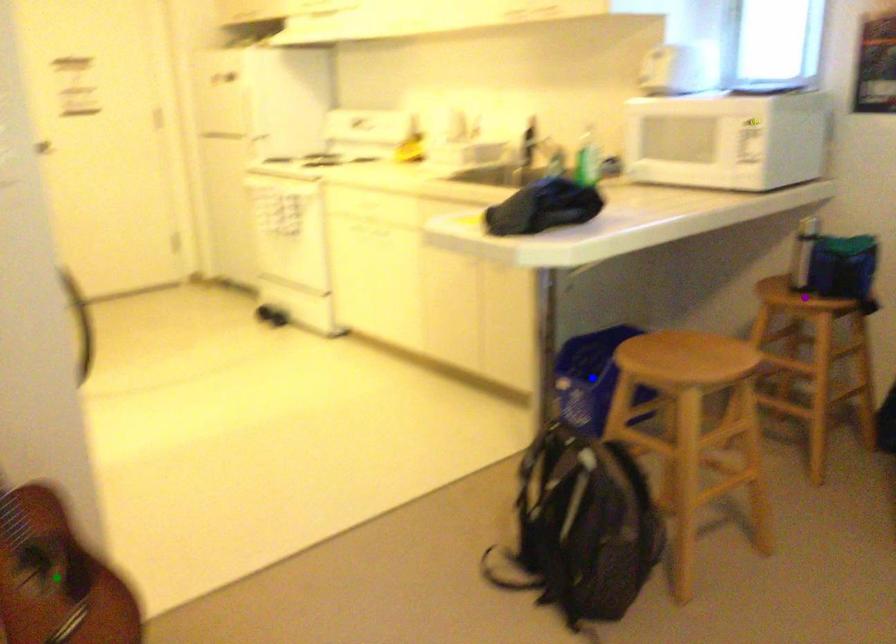
Order these from farthest to nearest:
blue point
purple point
green point

1. blue point
2. purple point
3. green point